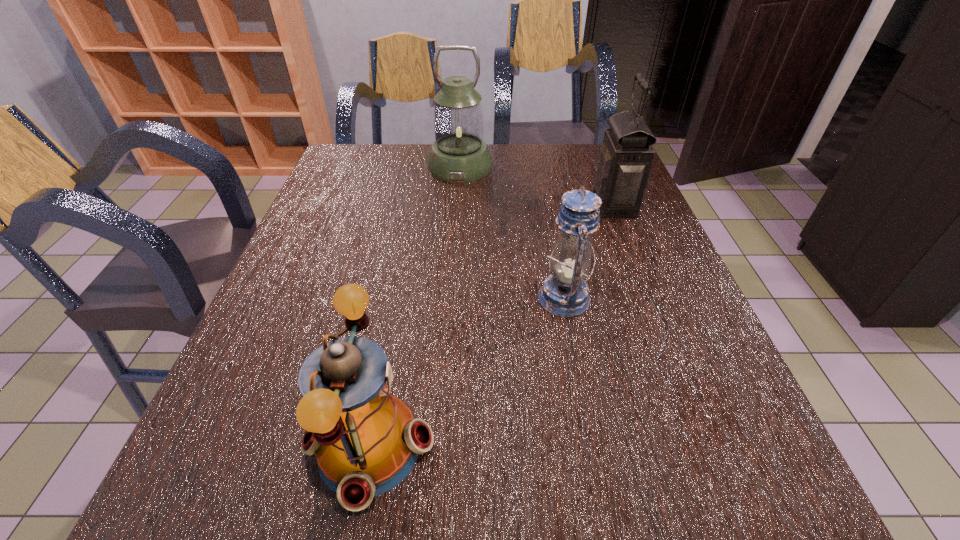
Locate which object is the closest to the rightmost lantern. Please provide its 2D coordinates. Your answer should be formatted as a tuple, i.e. [(x, y)], where the tuple contains the x and y coordinates of a point satisfying the conditions above.

[(564, 293)]

You are a GUI agent. You are given a task and a screenshot of the screen. Output one action in this format:
    pyautogui.click(x=<x>, y=<y>)
    Task: Click on the object that ranks as the third closest to the farthest object
    The image size is (960, 540).
    Given the screenshot: What is the action you would take?
    pyautogui.click(x=366, y=441)

Identify the location of lantern object that ranks as the third closest to the rightmost lantern. This screenshot has width=960, height=540. (366, 441).

At what (x,y) coordinates should I click in order to perform the action: click on the second closest lantern relative to the second farthest object. Please return your answer as a coordinate pair (x, y). Image resolution: width=960 pixels, height=540 pixels. Looking at the image, I should click on (459, 154).

This screenshot has width=960, height=540. What are the coordinates of `vacant space that satisfies the following two spatial constraints: 1. on the front side of the farthest object; 2. on the front-facing side of the nearest lantern` in the screenshot? It's located at (442, 446).